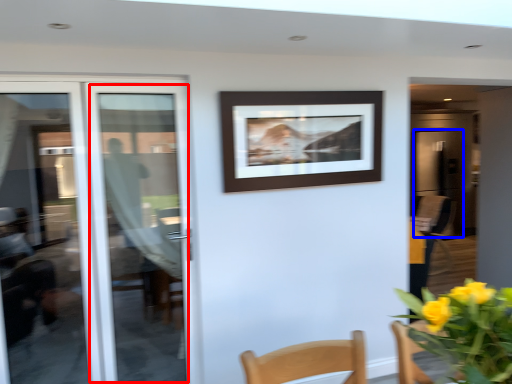
Question: Which point is further to the camera, door (highlighted by a red box) or screen door (highlighted by a blue box)?

Choices:
 (A) door
 (B) screen door

Answer: (B)